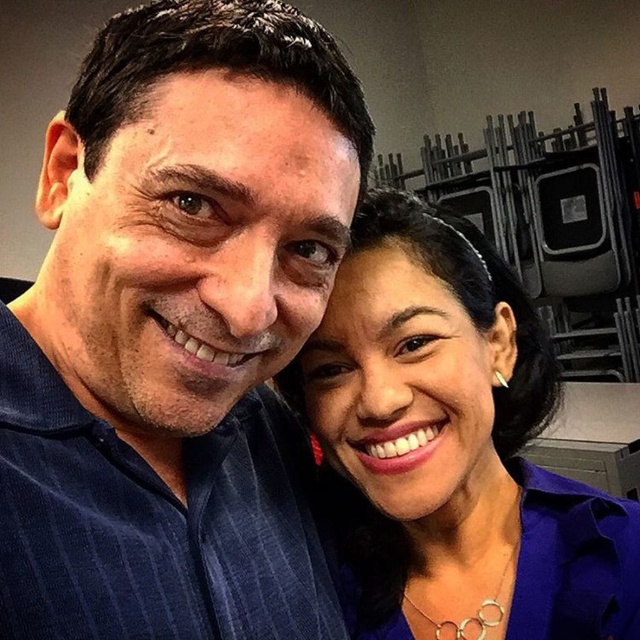
Image resolution: width=640 pixels, height=640 pixels. Describe the element at coordinates (177, 332) in the screenshot. I see `blue corduroy shirt at center` at that location.

Is point (145, 301) behind point (348, 513)?

No, it is in front of (348, 513).

Which is in front, point (312, 148) or point (420, 444)?

Point (312, 148)

I want to click on blue corduroy shirt at center, so click(177, 332).